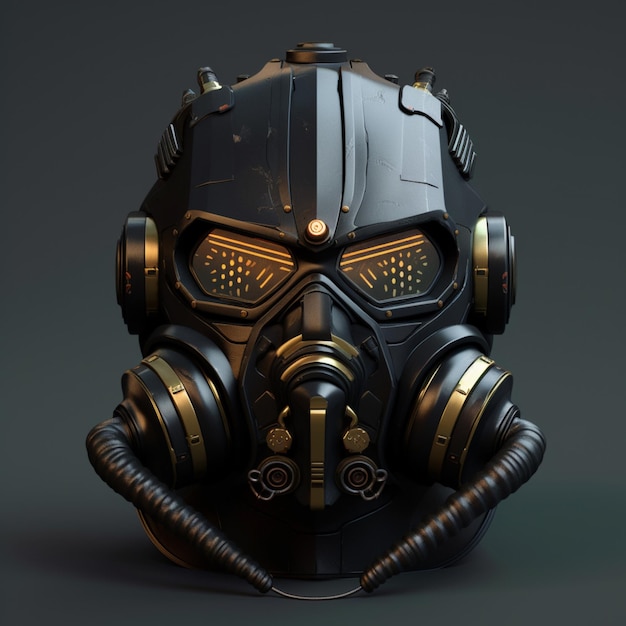
Where is `right side air filter`? The width and height of the screenshot is (626, 626). right side air filter is located at coordinates (453, 411).